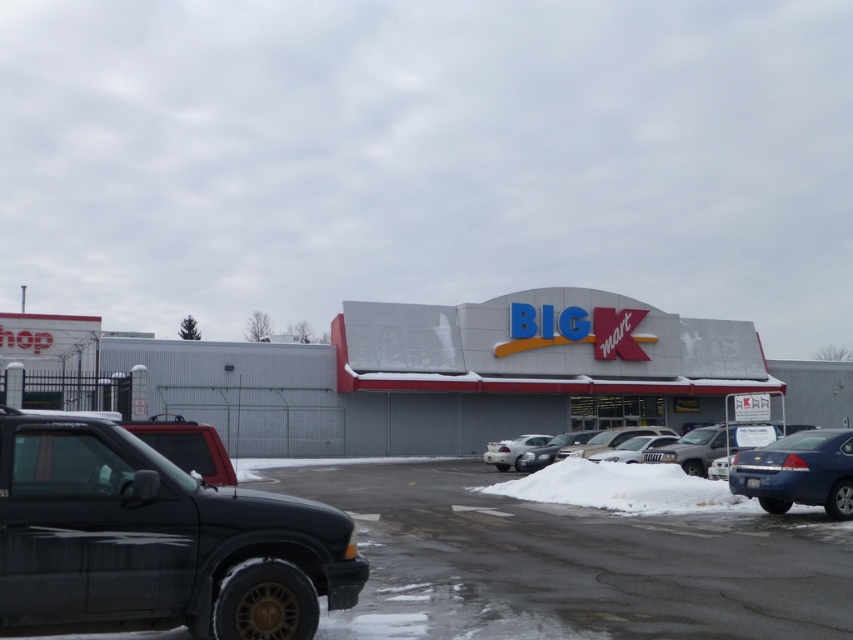
Question: Is metallic blue sedan at lower right thinner than satin silver sedan at center?

Choices:
 (A) no
 (B) yes

Answer: (A)

Question: Does snowy asphalt parking lot at lower left have a greater width compared to matte black suv at left?

Choices:
 (A) no
 (B) yes

Answer: (B)

Question: Estimate the real-world distances between objects in this image. Which object is closer to the snowy asphalt parking lot at lower left?

Choices:
 (A) silver metallic sedan at center
 (B) satin silver sedan at center
 (C) matte black suv at left
 (D) matte blue sedan at lower right

Answer: (D)

Question: Is matte blue sedan at lower right below silver metallic sedan at center?

Choices:
 (A) yes
 (B) no

Answer: (B)

Question: Which point is farther to the camera?

Choices:
 (A) (515, 468)
 (B) (544, 442)
 (C) (796, 499)

Answer: (B)

Question: Which of the following is the closest to the observer?

Choices:
 (A) (199, 540)
 (B) (541, 467)
 (C) (622, 458)

Answer: (A)